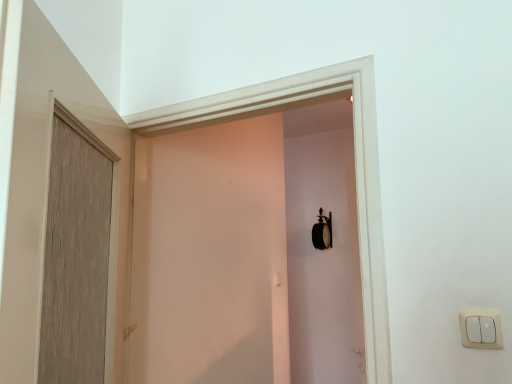
Question: Is matte white screen door at center in front of white plastic light switch at lower right?

Choices:
 (A) no
 (B) yes

Answer: (A)

Question: Is matte white screen door at center shorter than white plastic light switch at lower right?

Choices:
 (A) no
 (B) yes

Answer: (A)

Question: Is matte white screen door at center smaller than white plastic light switch at lower right?

Choices:
 (A) yes
 (B) no

Answer: (B)

Question: Is matte white screen door at center oriented towards white plastic light switch at lower right?

Choices:
 (A) no
 (B) yes

Answer: (A)

Question: Is matte white screen door at center further to the viewer compared to white plastic light switch at lower right?

Choices:
 (A) yes
 (B) no

Answer: (A)

Question: Is matte white screen door at center located outside white plastic light switch at lower right?

Choices:
 (A) yes
 (B) no

Answer: (A)

Question: Does wooden door at left have a lesser width compared to white plastic light switch at lower right?

Choices:
 (A) yes
 (B) no

Answer: (B)

Question: Can you see wooden door at left touching white plastic light switch at lower right?

Choices:
 (A) yes
 (B) no

Answer: (B)

Question: Can you confirm if wooden door at left is shorter than white plastic light switch at lower right?

Choices:
 (A) no
 (B) yes

Answer: (A)

Question: From a real-world perspective, is wooden door at left below white plastic light switch at lower right?

Choices:
 (A) yes
 (B) no

Answer: (B)

Question: Is wooden door at left facing towards white plastic light switch at lower right?

Choices:
 (A) yes
 (B) no

Answer: (A)

Question: Considering the relative positions of wooden door at left and white plastic light switch at lower right in the image provided, is wooden door at left to the left of white plastic light switch at lower right from the viewer's perspective?

Choices:
 (A) yes
 (B) no

Answer: (A)

Question: Can you confirm if white plastic light switch at lower right is positioned to the right of wooden door at left?

Choices:
 (A) no
 (B) yes

Answer: (B)